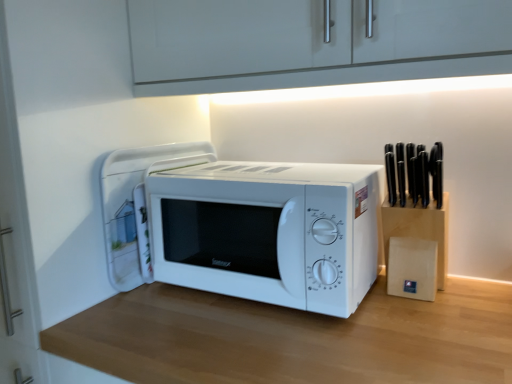
Question: Is wooden table at center directly adjacent to white matte microwave at center?

Choices:
 (A) no
 (B) yes

Answer: (A)

Question: Is white matte microwave at center at the back of wooden table at center?

Choices:
 (A) no
 (B) yes

Answer: (A)

Question: Does wooden table at center have a greater height compared to white matte microwave at center?

Choices:
 (A) no
 (B) yes

Answer: (B)

Question: Is wooden table at center closer to camera compared to white matte microwave at center?

Choices:
 (A) no
 (B) yes

Answer: (B)

Question: Would you say white matte microwave at center is part of wooden table at center's contents?

Choices:
 (A) no
 (B) yes

Answer: (A)

Question: Considering the relative sizes of wooden table at center and white matte microwave at center in the image provided, is wooden table at center smaller than white matte microwave at center?

Choices:
 (A) no
 (B) yes

Answer: (A)

Question: Does white matte microwave at center appear on the left side of white glossy microwave at center?

Choices:
 (A) yes
 (B) no

Answer: (B)

Question: Is white matte microwave at center directly adjacent to white glossy microwave at center?

Choices:
 (A) no
 (B) yes

Answer: (A)

Question: Is white matte microwave at center further to the viewer compared to white glossy microwave at center?

Choices:
 (A) yes
 (B) no

Answer: (B)

Question: Is white matte microwave at center looking in the opposite direction of white glossy microwave at center?

Choices:
 (A) no
 (B) yes

Answer: (A)

Question: Is white matte microwave at center smaller than white glossy microwave at center?

Choices:
 (A) no
 (B) yes

Answer: (A)

Question: From a real-world perspective, is white matte microwave at center positioned over white glossy microwave at center based on gravity?

Choices:
 (A) yes
 (B) no

Answer: (B)

Question: From a real-world perspective, is white glossy microwave at center positioned under wooden table at center based on gravity?

Choices:
 (A) yes
 (B) no

Answer: (B)